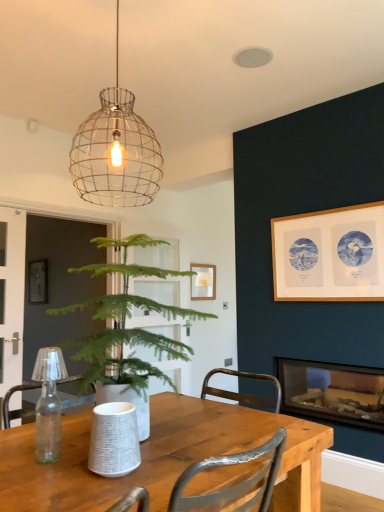
Question: Can you confirm if wire mesh pendant light at upper center is smaller than wooden table at center?

Choices:
 (A) no
 (B) yes

Answer: (A)

Question: Could you tell me if wire mesh pendant light at upper center is facing wooden table at center?

Choices:
 (A) no
 (B) yes

Answer: (A)

Question: Can you confirm if wire mesh pendant light at upper center is shorter than wooden table at center?

Choices:
 (A) yes
 (B) no

Answer: (B)

Question: Is wire mesh pendant light at upper center closer to camera compared to wooden table at center?

Choices:
 (A) yes
 (B) no

Answer: (B)

Question: From a real-world perspective, is wire mesh pendant light at upper center over wooden table at center?

Choices:
 (A) yes
 (B) no

Answer: (A)

Question: From a real-world perspective, is green leafy plant at center above or below wooden table at center?

Choices:
 (A) below
 (B) above

Answer: (B)

Question: From their relative heights in the image, would you say green leafy plant at center is taller or shorter than wooden table at center?

Choices:
 (A) tall
 (B) short

Answer: (A)

Question: Looking at the image, does green leafy plant at center seem bigger or smaller compared to wooden table at center?

Choices:
 (A) big
 (B) small

Answer: (A)

Question: From the image's perspective, relative to wooden table at center, is green leafy plant at center above or below?

Choices:
 (A) above
 (B) below

Answer: (A)

Question: Visually, is wooden picture frame at upper right positioned to the left or to the right of wooden table at center?

Choices:
 (A) right
 (B) left

Answer: (A)

Question: Based on their sizes in the image, would you say wooden picture frame at upper right is bigger or smaller than wooden table at center?

Choices:
 (A) small
 (B) big

Answer: (A)

Question: Is wooden picture frame at upper right taller or shorter than wooden table at center?

Choices:
 (A) short
 (B) tall

Answer: (B)

Question: From the image's perspective, relative to wooden table at center, is wooden picture frame at upper right above or below?

Choices:
 (A) below
 (B) above

Answer: (B)

Question: Is wire mesh pendant light at upper center to the left or to the right of wooden picture frame at upper right in the image?

Choices:
 (A) left
 (B) right

Answer: (A)

Question: From a real-world perspective, is wire mesh pendant light at upper center physically located above or below wooden picture frame at upper right?

Choices:
 (A) below
 (B) above

Answer: (B)